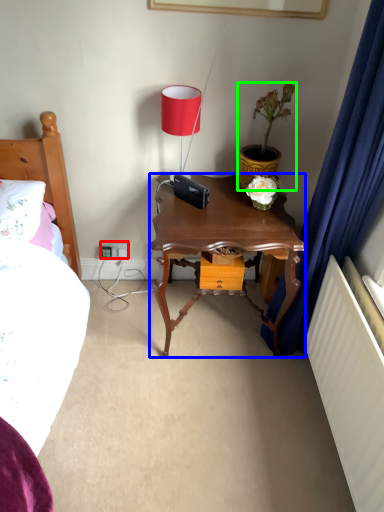
Question: Based on their relative distances, which object is farther from electric outlet (highlighted by a red box)? Choose from nightstand (highlighted by a blue box) and houseplant (highlighted by a green box).

Choices:
 (A) nightstand
 (B) houseplant

Answer: (B)